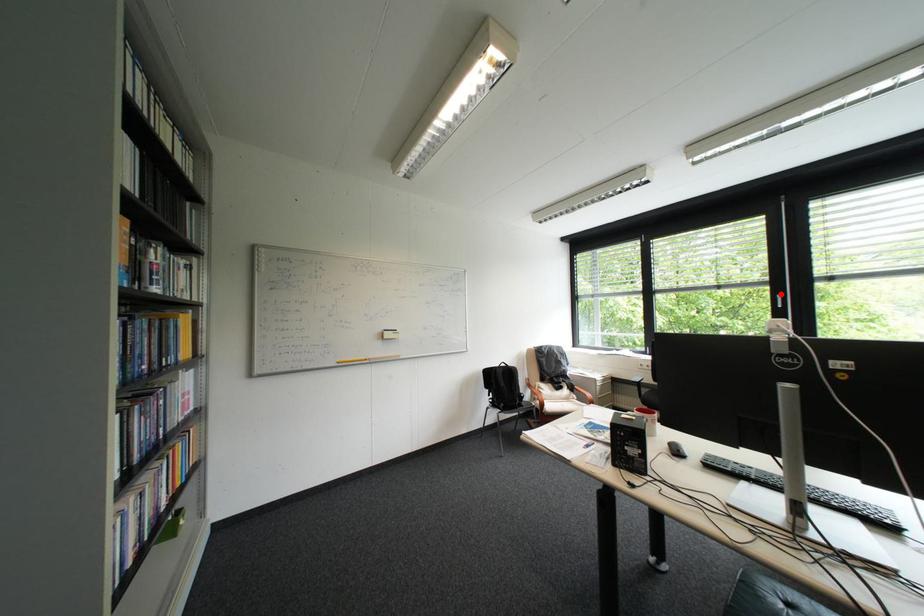
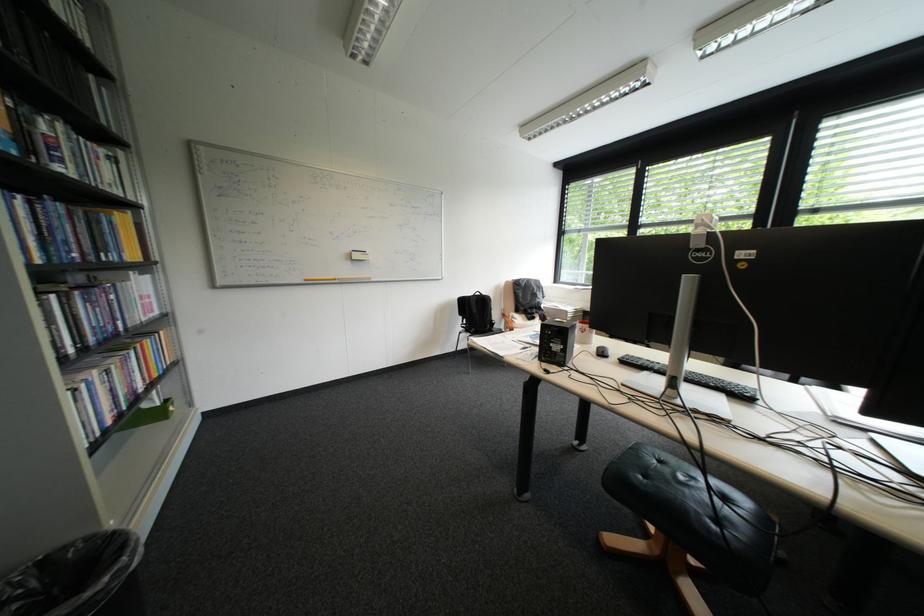
Question: I am providing you with two images of the same scene from different viewpoints. A red point is marked on the first image. Can you still see the location of the red point in image 2?

Choices:
 (A) Yes
 (B) No

Answer: (B)